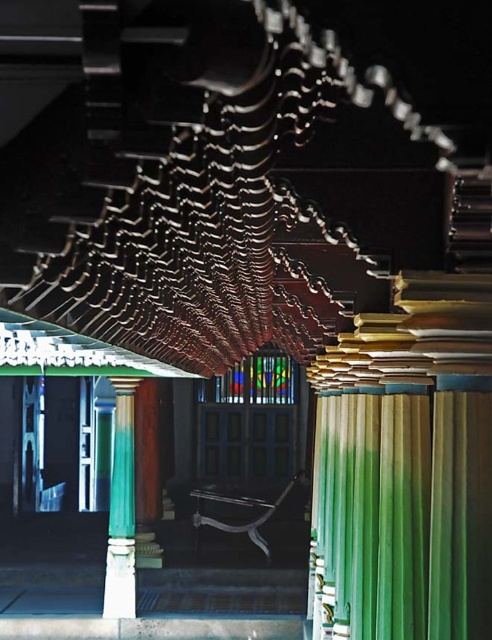
Is green fabric curtain at center behind green polished column at center?

No, green fabric curtain at center is closer to the viewer.

Does point (338, 440) come closer to viewer compared to point (114, 524)?

Yes, point (338, 440) is in front of point (114, 524).

This screenshot has width=492, height=640. In order to click on green fabric curtain at center in this screenshot , I will do `click(412, 502)`.